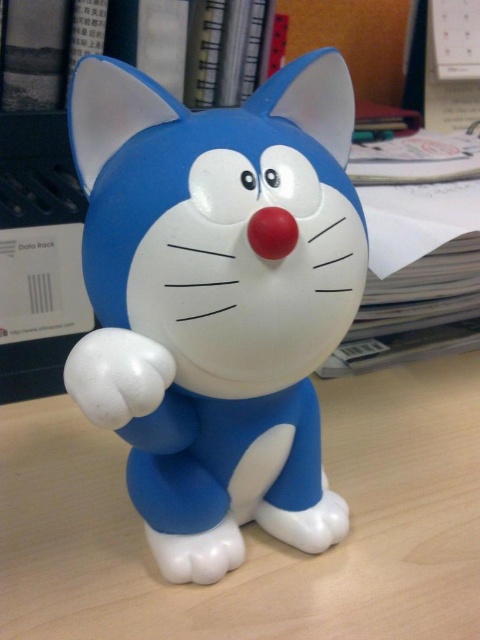
Who is more distant from viewer, [183,420] or [72,64]?

Positioned behind is point [72,64].

Does blue matte plastic cat at center have a greater width compared to matte plastic bookshelf at upper center?

No, blue matte plastic cat at center is not wider than matte plastic bookshelf at upper center.

Between point (330, 307) and point (116, 19), which one is positioned in front?

Point (330, 307)

Locate an element on the screen. This screenshot has height=640, width=480. blue matte plastic cat at center is located at coordinates (216, 300).

Does white matte computer desk at center have a greater width compared to matte plastic bookshelf at upper center?

Correct, the width of white matte computer desk at center exceeds that of matte plastic bookshelf at upper center.

Is white matte computer desk at center taller than matte plastic bookshelf at upper center?

No.

Find the location of a particular element. The height and width of the screenshot is (640, 480). white matte computer desk at center is located at coordinates (256, 528).

Image resolution: width=480 pixels, height=640 pixels. What are the coordinates of `blue matte plastic cat at center` in the screenshot? It's located at (216, 300).

Who is more forward, [245,218] or [68,634]?

Point [245,218]

Locate an element on the screen. The height and width of the screenshot is (640, 480). blue matte plastic cat at center is located at coordinates (216, 300).